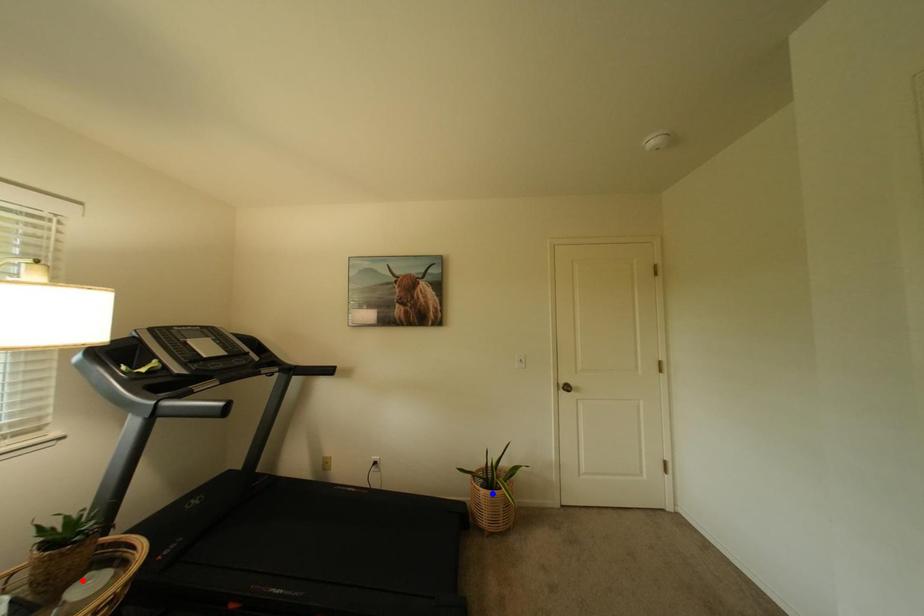
Question: In the image, two points are highlighted. Which point is nearer to the camera? Reply with the corresponding letter.

Choices:
 (A) blue point
 (B) red point

Answer: (B)